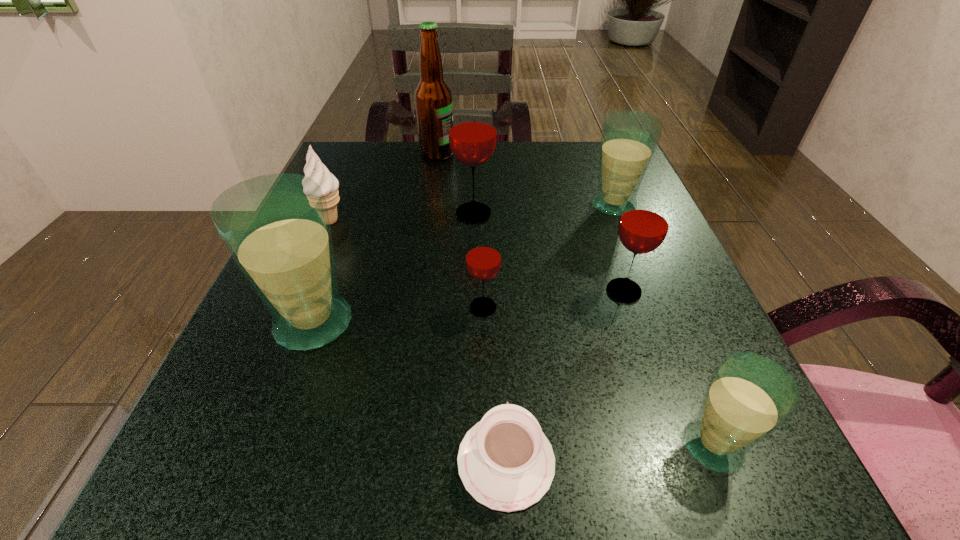
I want to click on the nearest glass, so click(x=749, y=396).

Where is `teacup`? This screenshot has width=960, height=540. teacup is located at coordinates pos(505,461).

Find the location of `free space located 0.120m on the label of the brown beer bottle`. free space located 0.120m on the label of the brown beer bottle is located at coordinates (504, 154).

Where is `free space located 0.260m on the front of the biggest red glass`? free space located 0.260m on the front of the biggest red glass is located at coordinates (471, 328).

Locate an element on the screen. Image resolution: width=960 pixels, height=540 pixels. vacant space located 0.140m on the front of the leftmost glass is located at coordinates (266, 453).

The height and width of the screenshot is (540, 960). Find the location of `free point located on the back of the rightmost red glass`. free point located on the back of the rightmost red glass is located at coordinates (609, 247).

In order to click on free space located on the front of the farthest blue glass in this screenshot , I will do `click(672, 354)`.

You are a GUI agent. You are given a task and a screenshot of the screen. Output one action in this format:
    pyautogui.click(x=<x>, y=<y>)
    Task: Click on the vacant region located 0.080m on the front-facing side of the icecream
    The height and width of the screenshot is (540, 960).
    Given the screenshot: What is the action you would take?
    pyautogui.click(x=387, y=220)

Identify the location of free region located 0.230m on the back of the smallest red glass. The height and width of the screenshot is (540, 960). (483, 215).

Image resolution: width=960 pixels, height=540 pixels. In order to click on free space located 0.090m on the back of the smallest blue glass in this screenshot , I will do `click(678, 359)`.